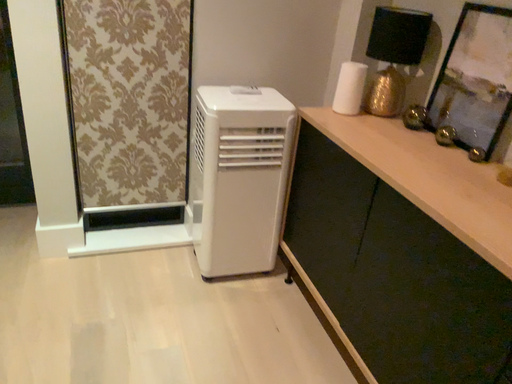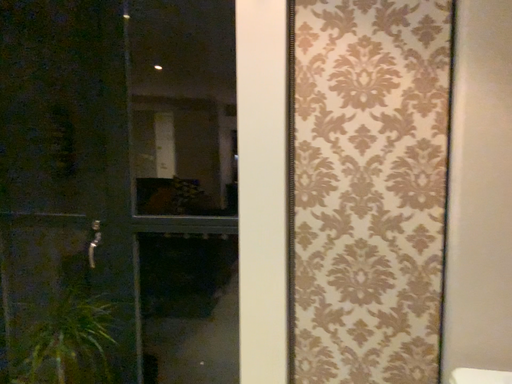
Question: How did the camera likely rotate when shooting the video?

Choices:
 (A) rotated left
 (B) rotated right

Answer: (A)